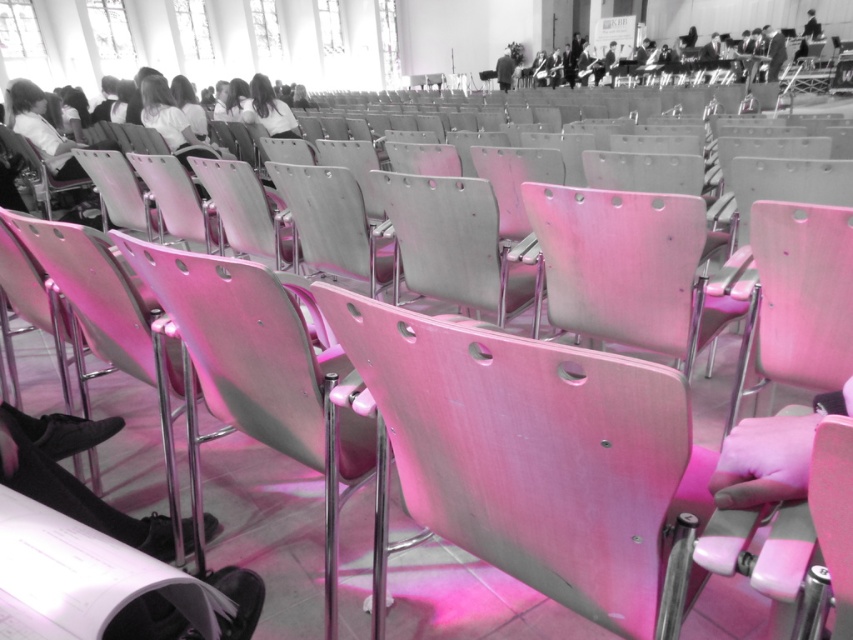
You are standing at the entrance of the hall and see the black leather shoes at lower left and the black fabric jacket at upper center. Which object is closer to your left side?

The black leather shoes at lower left are positioned on the left side of the black fabric jacket at upper center, so they are closer to your left side.

You are standing at the entrance of the auditorium and see the black leather shoes at lower left and the pink leather gloves at lower right. Which object is closer to you?

The black leather shoes at lower left are closer to you because they are further to the viewer than the pink leather gloves at lower right.

You are standing at the entrance of the auditorium and notice two items on the floor near the front row seats. The items are the black leather shoes at lower left and the pink leather gloves at lower right. From your perspective at the entrance, which item is closer to the stage?

The black leather shoes at lower left are closer to the stage because they are positioned below the pink leather gloves at lower right, indicating they are further forward in the seating area.